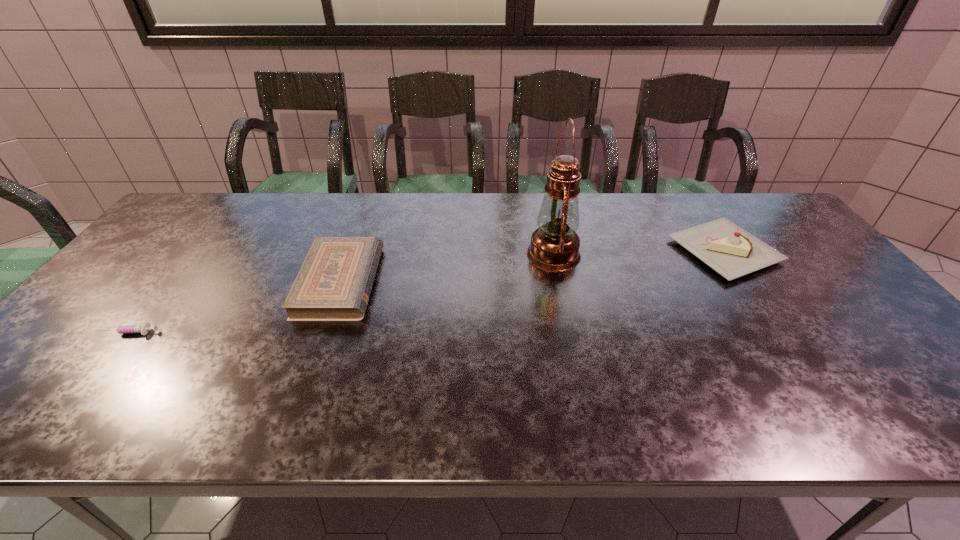
The height and width of the screenshot is (540, 960). I want to click on vacant space located 0.240m on the spine side of the Bible, so tap(464, 282).

Find the location of `vacant space located on the right of the shortest object`. vacant space located on the right of the shortest object is located at coordinates (191, 332).

I want to click on object at the far edge, so click(731, 251).

Where is `object that is at the left edge`? This screenshot has width=960, height=540. object that is at the left edge is located at coordinates (128, 329).

You are a GUI agent. You are given a task and a screenshot of the screen. Output one action in this format:
    pyautogui.click(x=<x>, y=<y>)
    Task: Click on the object present at the right edge
    This screenshot has width=960, height=540.
    Given the screenshot: What is the action you would take?
    pyautogui.click(x=731, y=251)

This screenshot has height=540, width=960. I want to click on object that is at the far right corner, so click(731, 251).

Identify the location of blank area at the far edge. 627,203.

Locate an element on the screen. The width and height of the screenshot is (960, 540). vacant space at the near edge is located at coordinates (195, 402).

Where is `free space at the left edge of the desktop`? The height and width of the screenshot is (540, 960). free space at the left edge of the desktop is located at coordinates (78, 341).

At what (x,y) coordinates should I click in order to perform the action: click on free space at the right edge of the desktop. Please return your answer as a coordinate pair (x, y). Looking at the image, I should click on (813, 285).